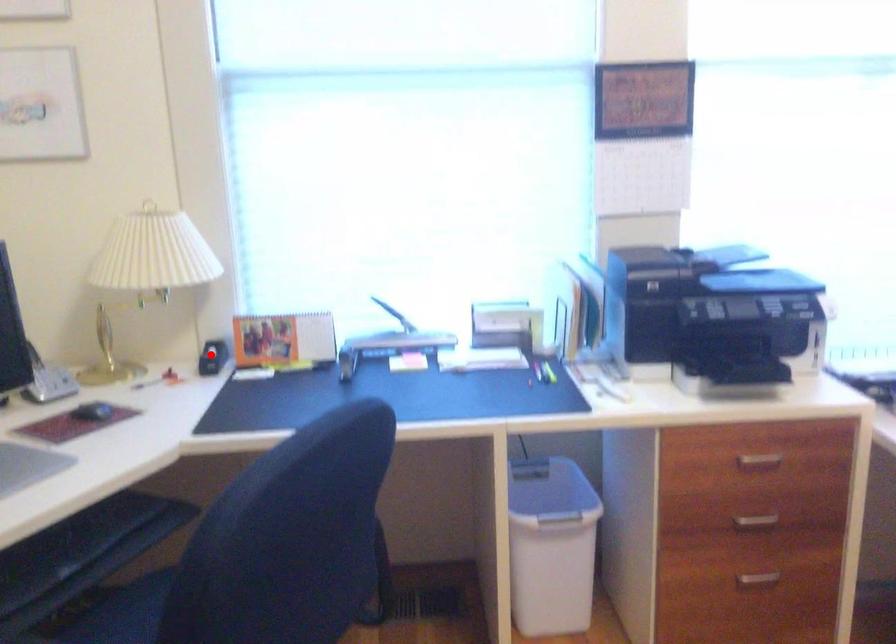
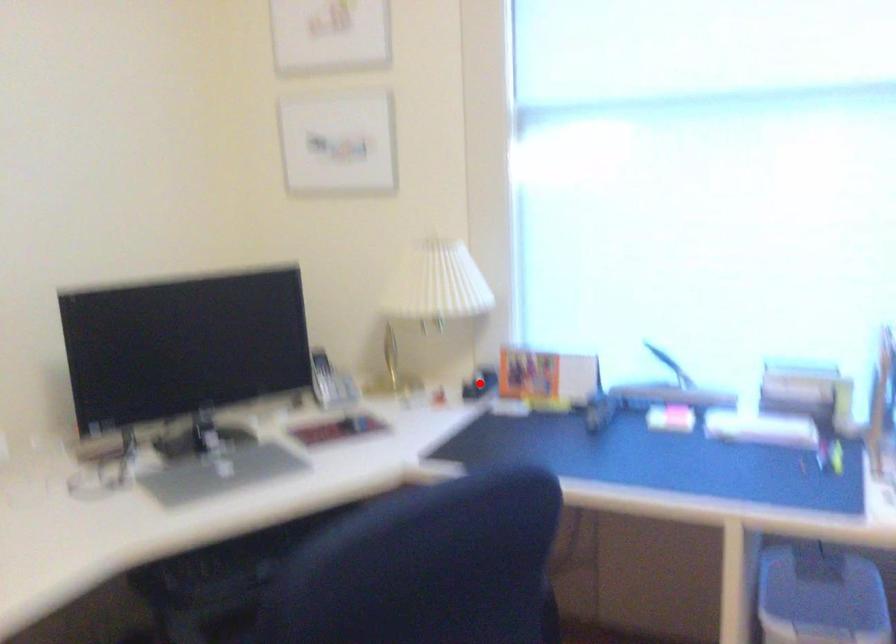
I am providing you with two images of the same scene from different viewpoints. A red point is marked on the first image and another point is marked on the second image. Are the points marked in image1 and image2 representing the same 3D position?

Yes